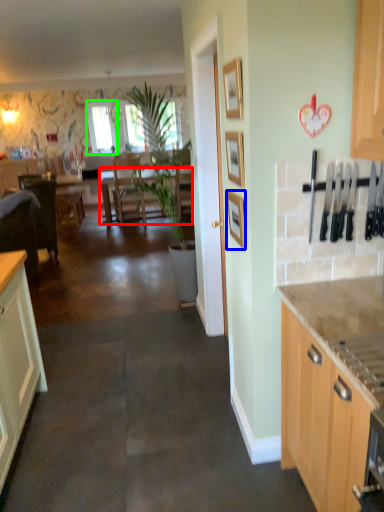
Question: Which object is positioned closest to table (highlighted by a red box)? Select from picture frame (highlighted by a blue box) and window screen (highlighted by a green box).

Choices:
 (A) picture frame
 (B) window screen

Answer: (B)